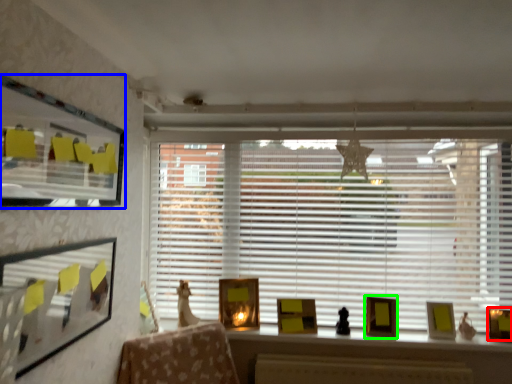
Question: Which is nearer to the picture frame (highlighted by a red box)? window screen (highlighted by a blue box) or picture frame (highlighted by a green box).

Choices:
 (A) window screen
 (B) picture frame

Answer: (B)